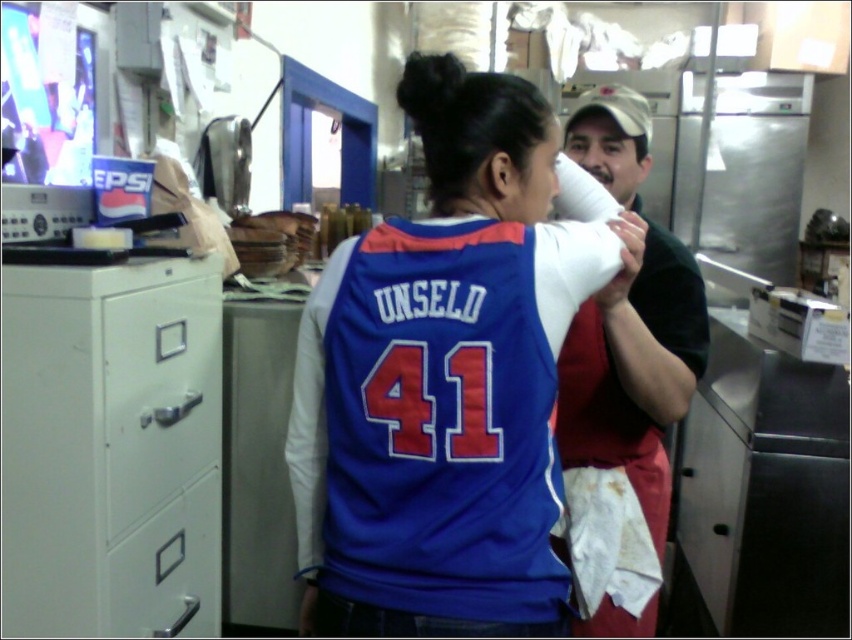
Consider the image. Which is above, white matte/file cabinet at left or matte black shirt at center?

matte black shirt at center is higher up.

Who is more distant from viewer, (1, 413) or (622, 328)?

The point (622, 328) is behind.

Find the location of `white matte/file cabinet at left`. white matte/file cabinet at left is located at coordinates (111, 449).

Is metallic gray file cabinet at left in front of metallic gray drawer at lower left?

Yes, metallic gray file cabinet at left is closer to the viewer.

Between point (137, 368) and point (193, 532), which one is positioned behind?

The point (193, 532) is behind.

I want to click on metallic gray file cabinet at left, so click(159, 396).

This screenshot has height=640, width=852. I want to click on metallic gray file cabinet at left, so tap(159, 396).

Which of these two, matte black shirt at center or metallic gray drawer at lower left, stands shorter?

Standing shorter between the two is metallic gray drawer at lower left.

Which is more to the right, matte black shirt at center or metallic gray drawer at lower left?

From the viewer's perspective, matte black shirt at center appears more on the right side.

Is point (612, 465) positioned behind point (194, 506)?

Yes, it is behind point (194, 506).

Identify the location of matte black shirt at center. This screenshot has width=852, height=640. (635, 371).